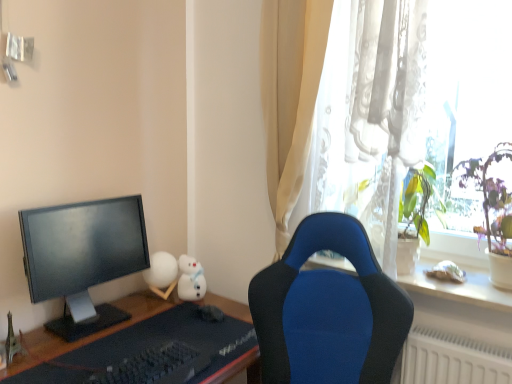
Where is `free space to the left of white matte sphere at center-left, which is the first toy from back to front`? The image size is (512, 384). free space to the left of white matte sphere at center-left, which is the first toy from back to front is located at coordinates click(123, 296).